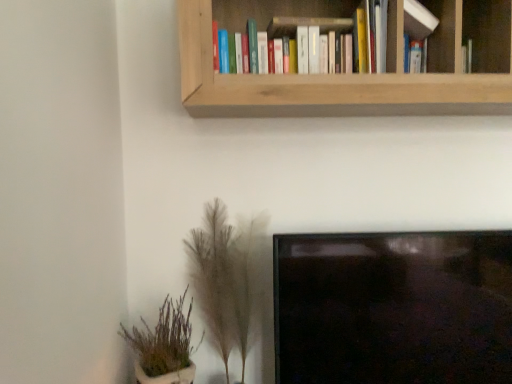
Question: Does fuzzy beige plant at lower center, the second houseplant positioned from the left, lie in front of wooden bookshelf at upper center?

Choices:
 (A) no
 (B) yes

Answer: (A)

Question: From the image's perspective, does fuzzy beige plant at lower center, positioned as the 1th houseplant in right-to-left order, appear lower than wooden bookshelf at upper center?

Choices:
 (A) no
 (B) yes

Answer: (B)

Question: Would you consider fuzzy beige plant at lower center, the second houseplant positioned from the left, to be distant from wooden bookshelf at upper center?

Choices:
 (A) no
 (B) yes

Answer: (A)

Question: Can you confirm if fuzzy beige plant at lower center, positioned as the 1th houseplant in right-to-left order, is positioned to the right of wooden bookshelf at upper center?

Choices:
 (A) no
 (B) yes

Answer: (A)

Question: From a real-world perspective, is fuzzy beige plant at lower center, the second houseplant positioned from the left, located beneath wooden bookshelf at upper center?

Choices:
 (A) no
 (B) yes

Answer: (B)

Question: In the image, is hardcover books at upper center, placed as the 2th book when sorted from right to left, on the left side or the right side of green leafy plant at lower left, which is the 1th houseplant from left to right?

Choices:
 (A) right
 (B) left

Answer: (A)

Question: Does point (303, 0) appear closer or farther from the camera than point (135, 326)?

Choices:
 (A) closer
 (B) farther

Answer: (A)

Question: From the image's perspective, is hardcover books at upper center, the first book in the left-to-right sequence, above or below green leafy plant at lower left, the 2th houseplant from the right?

Choices:
 (A) below
 (B) above

Answer: (B)

Question: From a real-world perspective, is hardcover books at upper center, the first book in the left-to-right sequence, physically located above or below green leafy plant at lower left, the 2th houseplant from the right?

Choices:
 (A) below
 (B) above

Answer: (B)

Question: From a real-world perspective, is white matte book at upper right, marked as the first book in a right-to-left arrangement, physically located above or below hardcover books at upper center, placed as the 2th book when sorted from right to left?

Choices:
 (A) above
 (B) below

Answer: (A)

Question: Considering their positions, is white matte book at upper right, the 2th book positioned from the left, located in front of or behind hardcover books at upper center, the first book in the left-to-right sequence?

Choices:
 (A) behind
 (B) front

Answer: (A)

Question: In terms of width, does white matte book at upper right, the 2th book positioned from the left, look wider or thinner when compared to hardcover books at upper center, the first book in the left-to-right sequence?

Choices:
 (A) thin
 (B) wide

Answer: (A)

Question: Is point (431, 16) closer or farther from the camera than point (306, 4)?

Choices:
 (A) farther
 (B) closer

Answer: (B)

Question: Is point (422, 16) closer or farther from the camera than point (210, 16)?

Choices:
 (A) farther
 (B) closer

Answer: (A)

Question: In the image, is white matte book at upper right, marked as the first book in a right-to-left arrangement, on the left side or the right side of wooden bookshelf at upper center?

Choices:
 (A) left
 (B) right

Answer: (B)